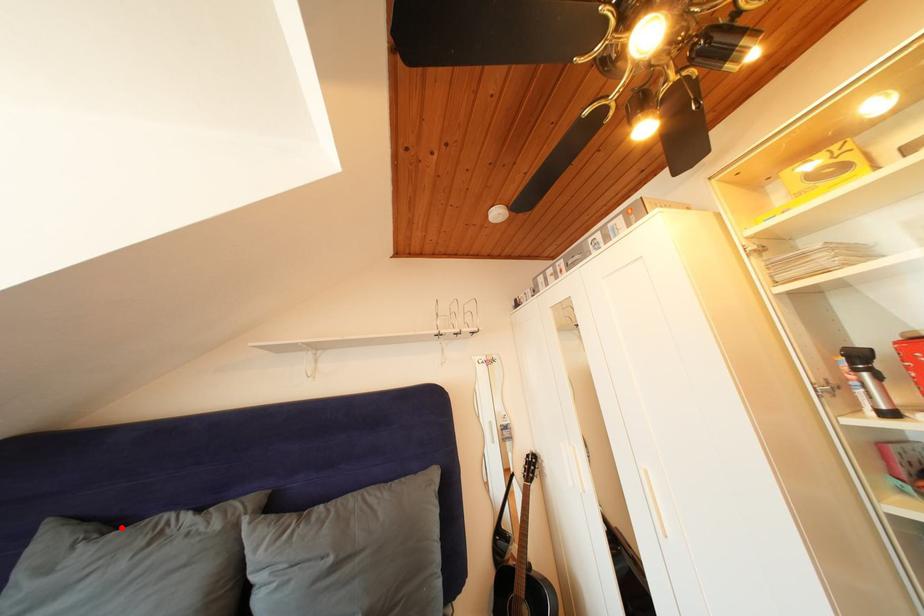
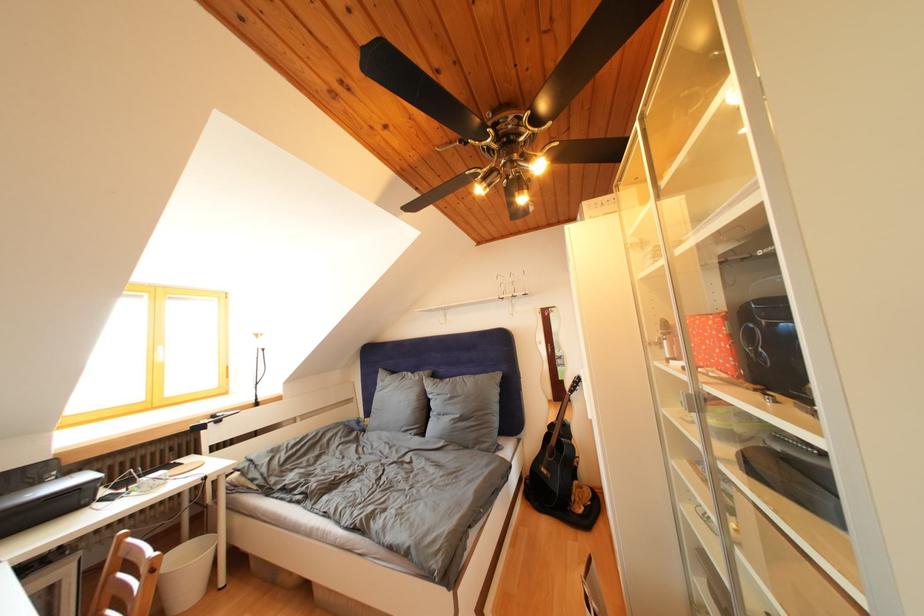
Question: I am providing you with two images of the same scene from different viewpoints. In image1, a red point is highlighted. Considering the same 3D point in image2, which of the following is correct?

Choices:
 (A) It is closer
 (B) It is farther

Answer: (B)